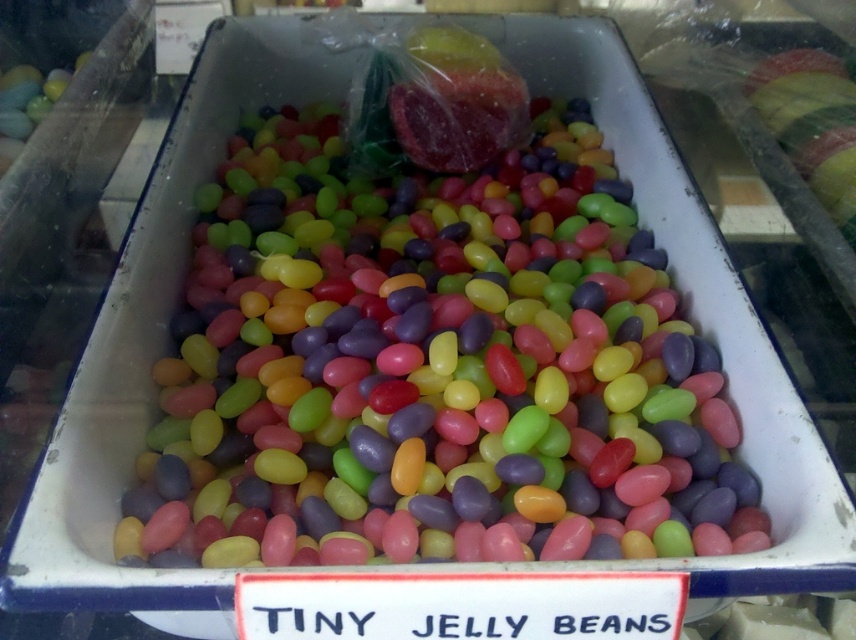
Who is lower down, glossy jelly beans at center or shiny metallic apple at upper right?

glossy jelly beans at center is below.

Can you confirm if glossy jelly beans at center is thinner than shiny metallic apple at upper right?

No, glossy jelly beans at center is not thinner than shiny metallic apple at upper right.

Where is `glossy jelly beans at center`? glossy jelly beans at center is located at coordinates (432, 372).

At what (x,y) coordinates should I click in order to perform the action: click on glossy jelly beans at center. Please return your answer as a coordinate pair (x, y). Looking at the image, I should click on (432, 372).

Can you confirm if shiny metallic apple at upper right is taller than matte plastic eggs at upper left?

Yes.

In the scene shown: Can you confirm if shiny metallic apple at upper right is wider than matte plastic eggs at upper left?

Indeed, shiny metallic apple at upper right has a greater width compared to matte plastic eggs at upper left.

Is point (837, 106) positioned behind point (13, 93)?

No.

Where is `shiny metallic apple at upper right`? This screenshot has height=640, width=856. shiny metallic apple at upper right is located at coordinates (812, 124).

Does glossy jelly beans at center come behind matte plastic eggs at upper left?

No, glossy jelly beans at center is closer to the viewer.

Is glossy jelly beans at center positioned before matte plastic eggs at upper left?

Yes, it is in front of matte plastic eggs at upper left.

Does point (355, 531) lie behind point (21, 134)?

No, (355, 531) is in front of (21, 134).

Identify the location of glossy jelly beans at center. (432, 372).